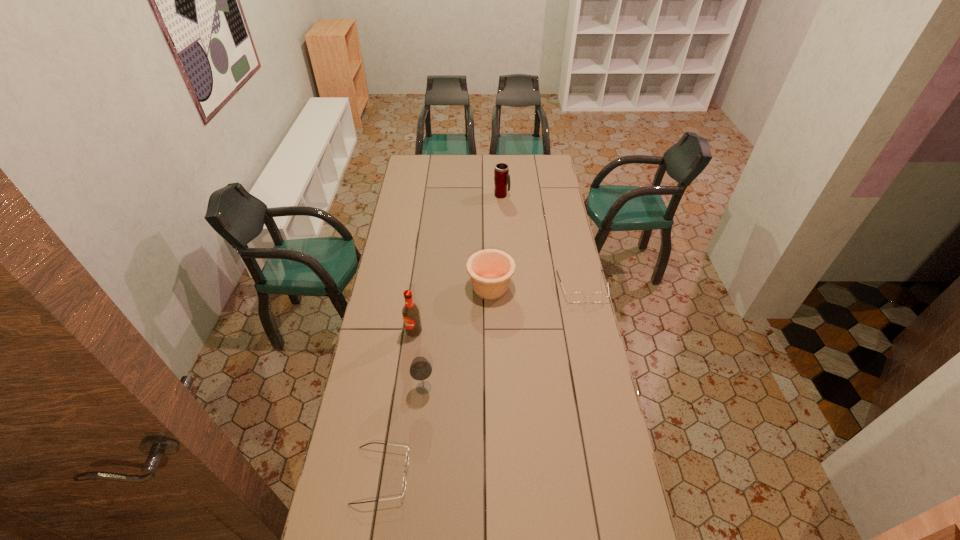
Locate an element on the screen. The image size is (960, 540). empty space that is in between the left spectacles and the farthest object is located at coordinates (442, 335).

The image size is (960, 540). Find the location of `free area in between the fifth tallest object and the second nearest object`. free area in between the fifth tallest object and the second nearest object is located at coordinates (503, 337).

The image size is (960, 540). I want to click on free spot between the left spectacles and the tallest object, so click(397, 403).

Select which object appears as the fifth closest to the pottery. Please provide its 2D coordinates. Your answer should be formatted as a tuple, i.e. [(x, y)], where the tuple contains the x and y coordinates of a point satisfying the conditions above.

[(407, 453)]

What are the coordinates of `object that stands as the second closest to the taller spectacles` in the screenshot? It's located at (501, 172).

This screenshot has height=540, width=960. I want to click on blank space that satisfies the following two spatial constraints: 1. on the side with the handle of the thermos bottle; 2. on the front side of the beer bottle, so pos(510,331).

Identify the location of blank area in the image that satisfies the following two spatial constraints: 1. through the lenses of the rightmost object; 2. through the lenses of the shorter spectacles. Image resolution: width=960 pixels, height=540 pixels. (626, 475).

I want to click on free spot that satisfies the following two spatial constraints: 1. on the front side of the fifth farthest object; 2. through the lenses of the nearest object, so click(x=415, y=475).